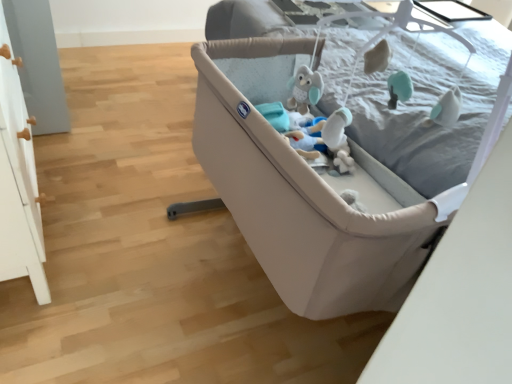
Question: Would you say soft gray fabric mattress at upper right is to the left or to the right of white plush toy at center in the picture?

Choices:
 (A) left
 (B) right

Answer: (B)

Question: From a real-world perspective, relative to white plush toy at center, is soft gray fabric mattress at upper right vertically above or below?

Choices:
 (A) above
 (B) below

Answer: (A)

Question: Which of these objects is positioned closest to the soft gray fabric mattress at upper right?

Choices:
 (A) white plush toy at center
 (B) beige fabric crib at center

Answer: (A)

Question: Which object is positioned closest to the beige fabric crib at center?

Choices:
 (A) white plush toy at center
 (B) soft gray fabric mattress at upper right

Answer: (A)